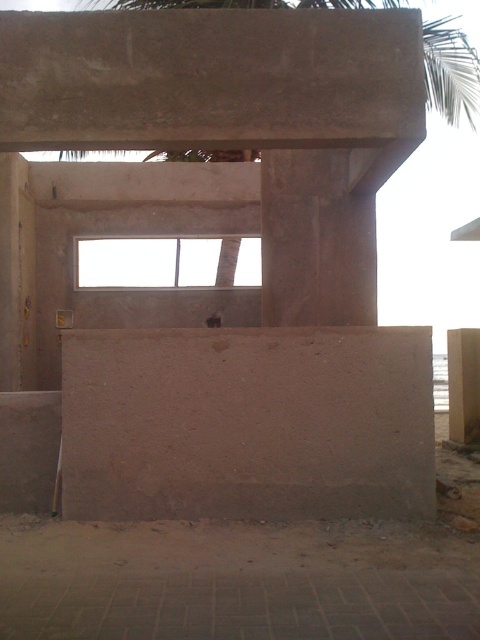
You are standing in front of the partially constructed building and notice the green leafy palm tree at upper center and the matte concrete window at center. Which object is positioned to the right side when viewed from your perspective?

The green leafy palm tree at upper center is to the right of the matte concrete window at center.

You are an architect designing a new building and you want to place a decorative sculpture exactly at the center of the smooth concrete wall at center. According to the image, what are the coordinates where you should place the sculpture?

The smooth concrete wall at center is located at coordinates point (248, 422), so the decorative sculpture should be placed at those coordinates.